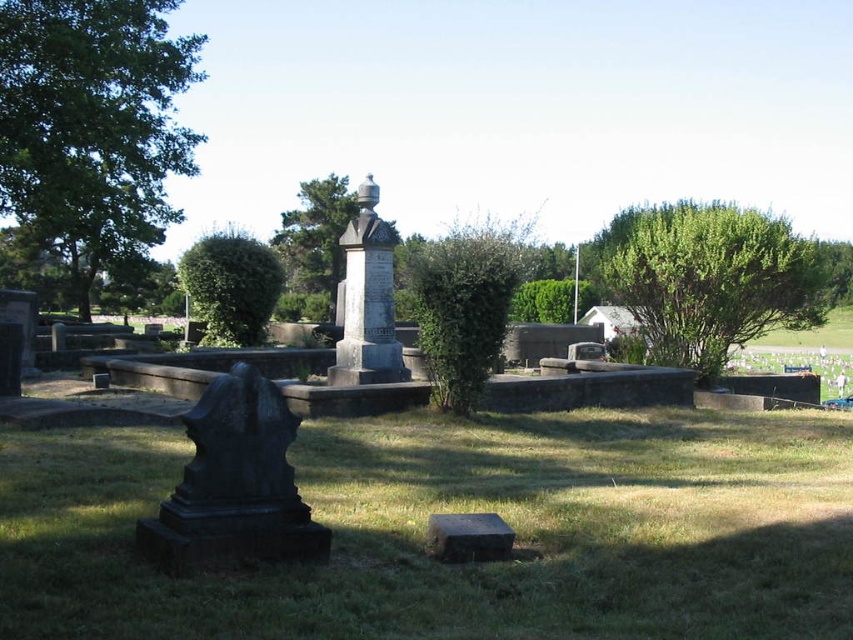
Question: Can you confirm if green leafy bush at upper right is positioned to the left of black stone statue at lower left?

Choices:
 (A) yes
 (B) no

Answer: (B)

Question: Which point is closer to the camera?

Choices:
 (A) (834, 458)
 (B) (389, 250)

Answer: (A)

Question: Considering the real-world distances, which object is closest to the black stone statue at lower left?

Choices:
 (A) black granite gravestone at lower center
 (B) green leafy bush at upper right

Answer: (A)

Question: Can you confirm if green leafy tree at upper left is thinner than green leafy bush at upper right?

Choices:
 (A) no
 (B) yes

Answer: (A)

Question: Does green leafy bush at center appear under black granite gravestone at lower center?

Choices:
 (A) yes
 (B) no

Answer: (B)

Question: Which of the following is the farthest from the observer?

Choices:
 (A) green leafy bush at center
 (B) green grass at lower center
 (C) granite gravestone at center
 (D) green leafy bush at upper right

Answer: (A)